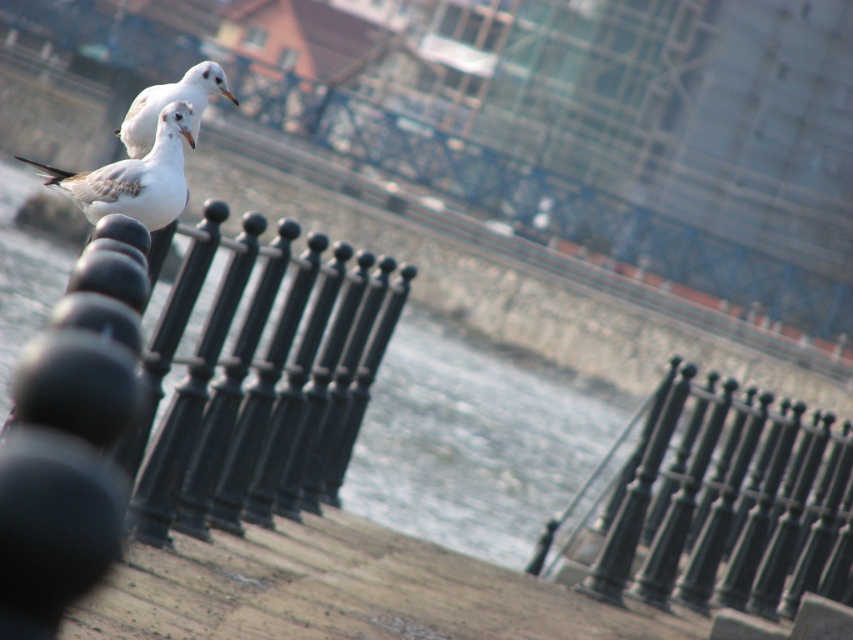
You are standing at the camera position and want to reach the point marked at coordinates (408, 563). Can you walk directly to it from where you are?

The point at (408, 563) is 36.43 feet away from the camera, so yes, you can walk directly to it as there is no mention of obstacles in the scene description.

You are a birdwatcher trying to identify seagulls in the image. Based on their positions and the scene description, which seagull is positioned closer to the observer, the white feathered seagull at center or the white matte seagull at upper center?

The white feathered seagull at center is positioned closer to the observer because it is at the center and the white matte seagull at upper center is placed higher up, typically indicating distance in such scenes.